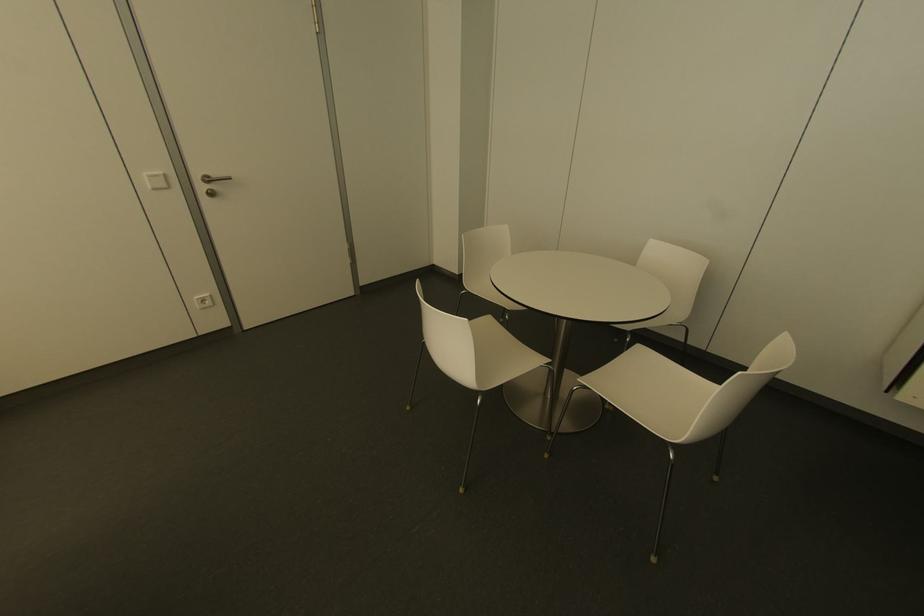
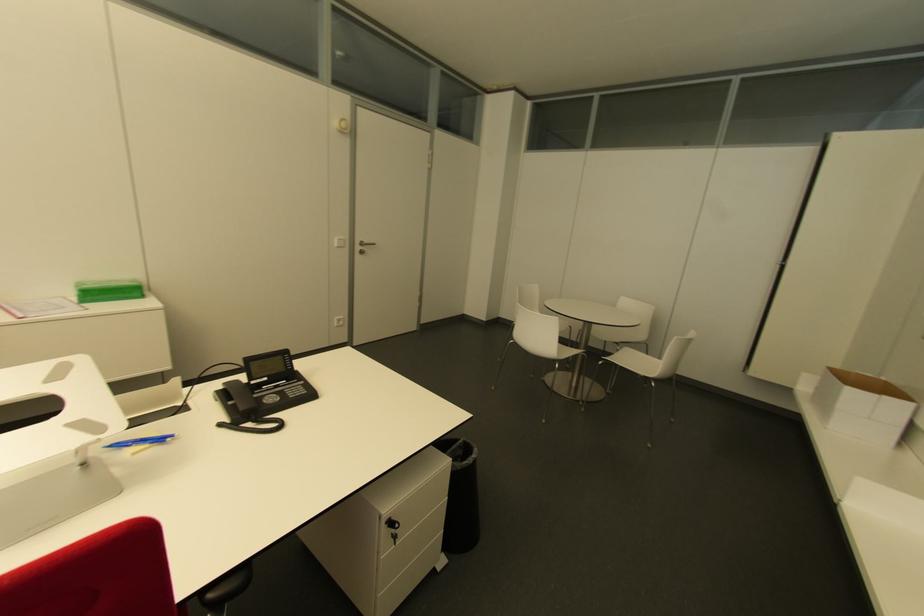
Find the pixel in the second image that matches point (163, 176) in the first image.

(343, 240)